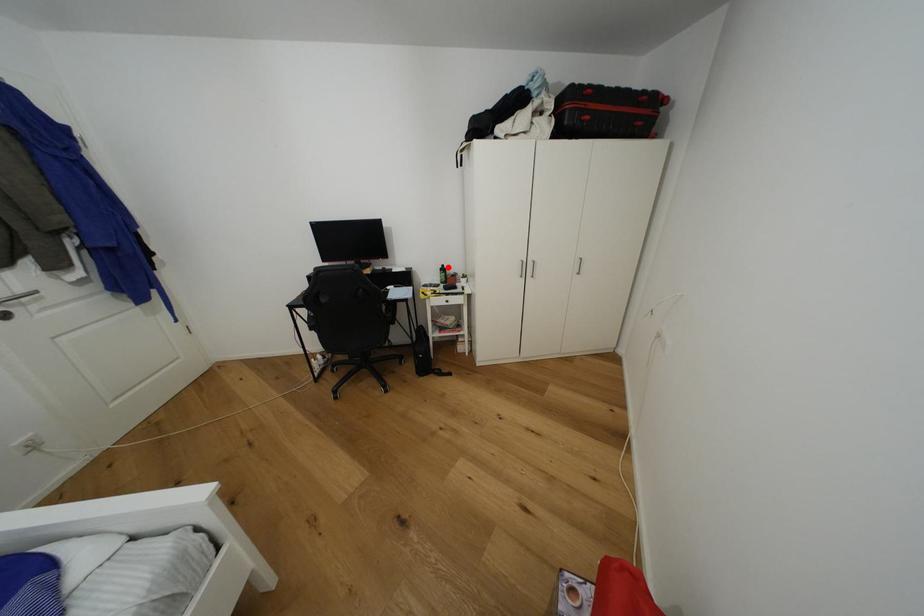
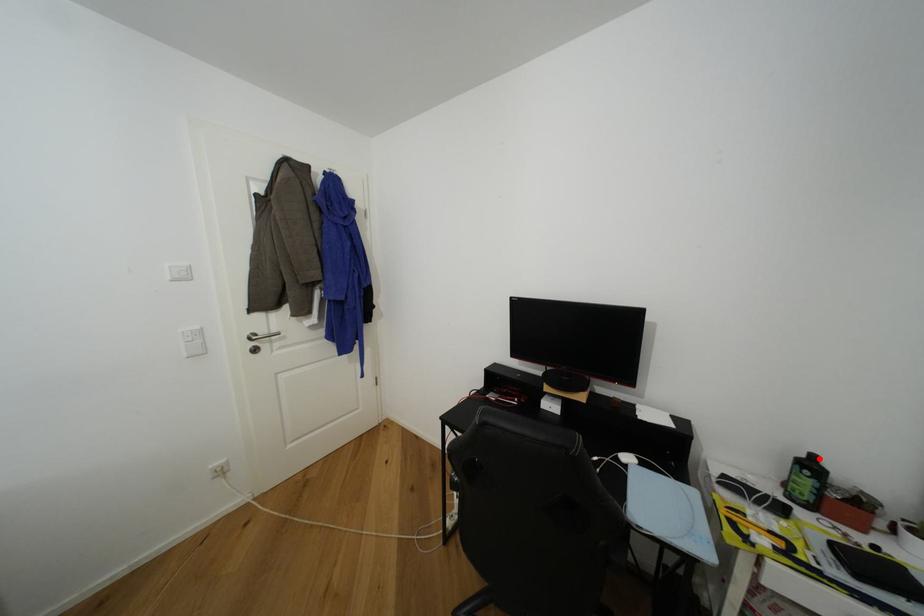
I am providing you with two images of the same scene from different viewpoints. A red point is marked on the first image and another point is marked on the second image. Do the highlighted points in image1 and image2 indicate the same real-world spot?

Yes